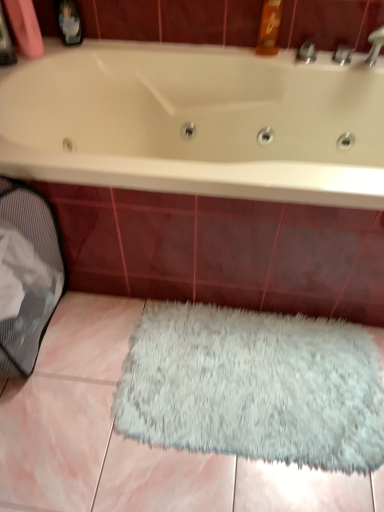
Locate an element on the screen. vacant space underneath white fluffy rug at lower center (from a real-world perspective) is located at coordinates (251, 384).